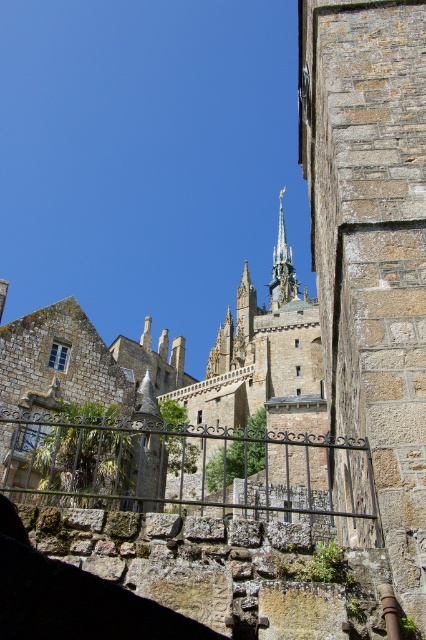
Can you confirm if stone medieval castle at center is positioned to the left of polished bronze spire at center?

Correct, you'll find stone medieval castle at center to the left of polished bronze spire at center.

Who is shorter, stone medieval castle at center or polished bronze spire at center?

stone medieval castle at center

I want to click on stone medieval castle at center, so (x=178, y=424).

I want to click on stone medieval castle at center, so click(x=178, y=424).